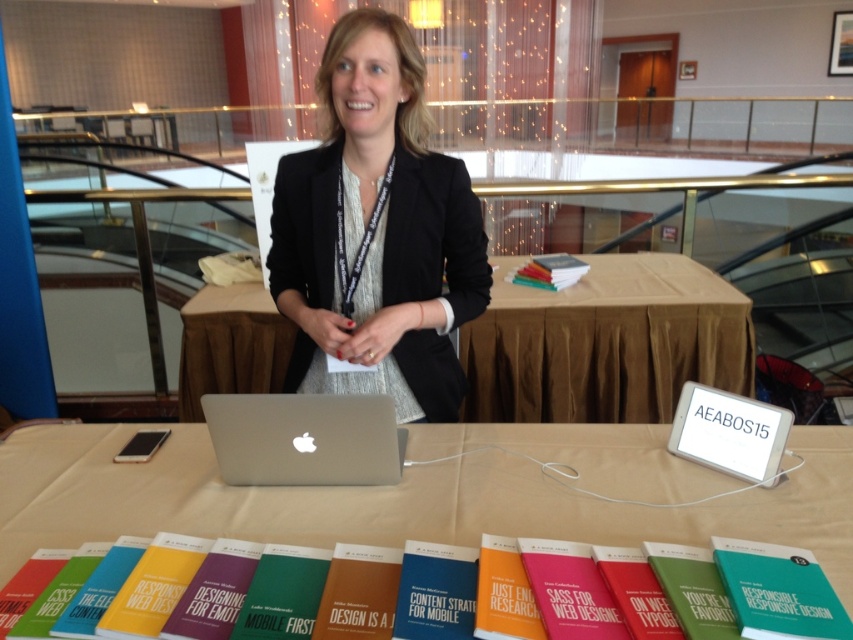
Question: Among these points, which one is nearest to the camera?

Choices:
 (A) (209, 544)
 (B) (646, 564)

Answer: (B)

Question: In this image, where is silver metallic laptop at center located relative to matte yellow book at center?

Choices:
 (A) left
 (B) right

Answer: (B)

Question: Which point is closer to the camera?

Choices:
 (A) green matte book at lower center
 (B) black textured blazer at center
 (C) hardcover book at center
 (D) matte yellow book at center

Answer: (A)

Question: Can you confirm if yellow matte book at center is positioned to the right of hardcover book at center?

Choices:
 (A) no
 (B) yes

Answer: (A)

Question: Is green matte book at lower center wider than hardcover book at center?

Choices:
 (A) no
 (B) yes

Answer: (B)

Question: Which point is farther from the camera taking this photo?

Choices:
 (A) (165, 563)
 (B) (276, 422)

Answer: (B)